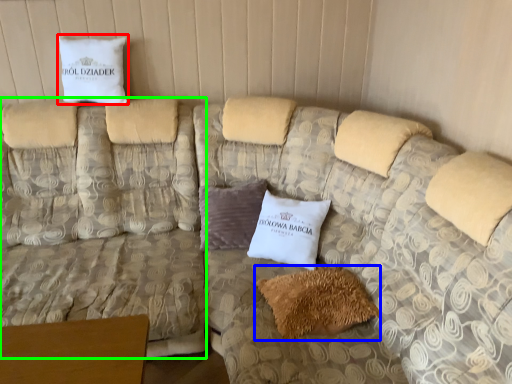
Question: Which is nearer to the pillow (highlighted by a red box)? pillow (highlighted by a blue box) or couch (highlighted by a green box).

Choices:
 (A) pillow
 (B) couch

Answer: (B)